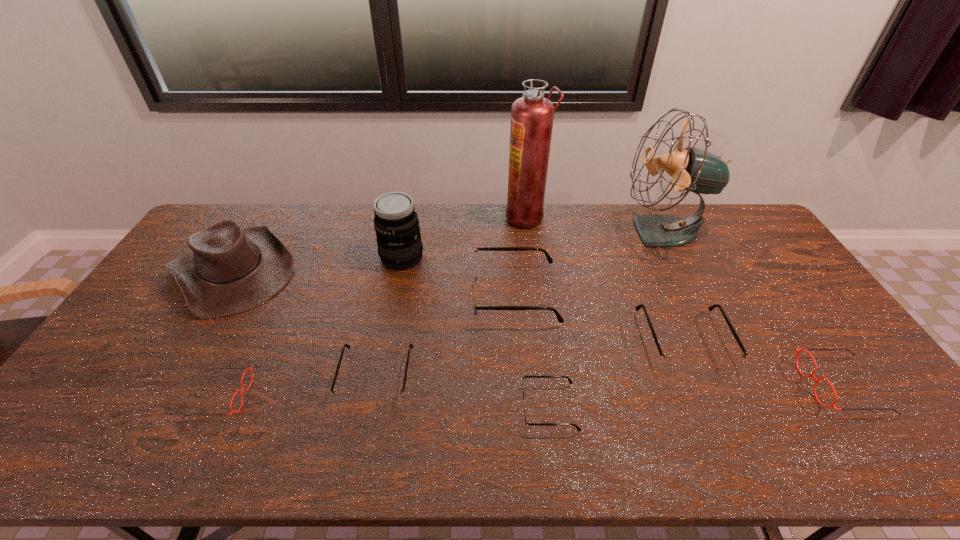
Point out which black spectacles is positioned as the nearest to the fan. Please provide its 2D coordinates. Your answer should be formatted as a tuple, i.e. [(x, y)], where the tuple contains the x and y coordinates of a point satisfying the conditions above.

[(673, 362)]

The height and width of the screenshot is (540, 960). What are the coordinates of `free spot that satisfies the following two spatial constraints: 1. at the hinge ends of the third biggest black spectacles; 2. on the front-facing side of the left red spectacles` in the screenshot? It's located at (372, 396).

Find the location of a particular element. vacant area that satisfies the following two spatial constraints: 1. at the hinge ends of the fifth tallest object; 2. at the hinge ends of the leftmost black spectacles is located at coordinates (520, 376).